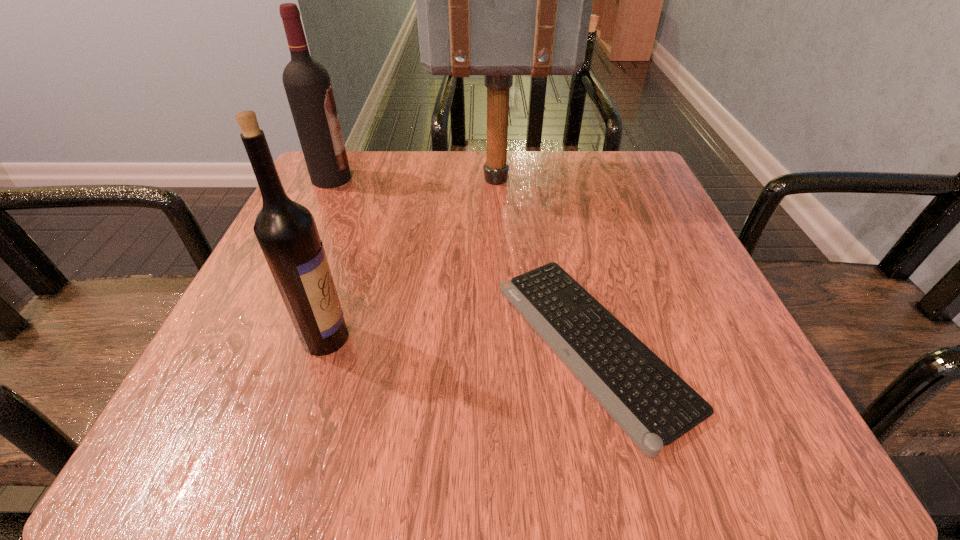
The image size is (960, 540). Find the location of `free spot that satisfies the following two spatial constraints: 1. on the label of the shortest object; 2. on the right side of the third object from right to left`. free spot that satisfies the following two spatial constraints: 1. on the label of the shortest object; 2. on the right side of the third object from right to left is located at coordinates (324, 345).

At what (x,y) coordinates should I click in order to perform the action: click on free location that satisfies the following two spatial constraints: 1. on the back side of the computer keyboard; 2. on the label of the right wine bottle. Please return your answer as a coordinate pair (x, y). Image resolution: width=960 pixels, height=540 pixels. Looking at the image, I should click on (590, 338).

The width and height of the screenshot is (960, 540). I want to click on free region that satisfies the following two spatial constraints: 1. on the label of the leftmost object; 2. on the right side of the computer keyboard, so click(252, 345).

You are a GUI agent. You are given a task and a screenshot of the screen. Output one action in this format:
    pyautogui.click(x=<x>, y=<y>)
    Task: Click on the free space that satisfies the following two spatial constraints: 1. on the label of the computer keyboard; 2. on the right side of the leftmost object
    This screenshot has width=960, height=540.
    Given the screenshot: What is the action you would take?
    pyautogui.click(x=252, y=345)